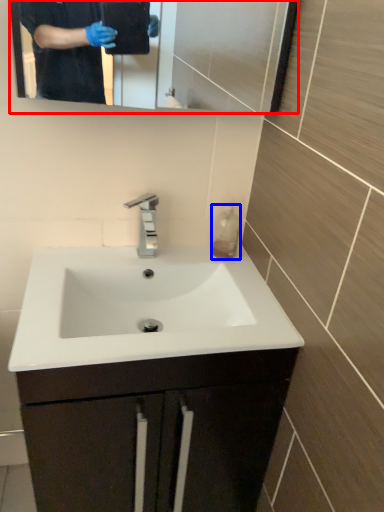
Question: Which point is further to the camera, mirror (highlighted by a red box) or liquid (highlighted by a blue box)?

Choices:
 (A) mirror
 (B) liquid

Answer: (B)